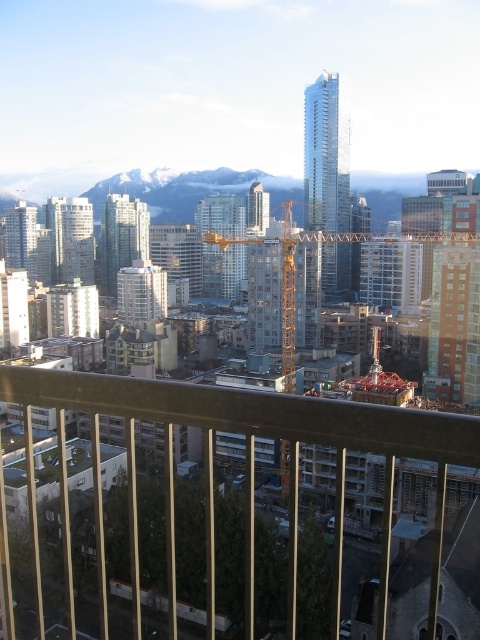
You are standing on a balcony and see a point marked at coordinates (247, 448). Based on the scene, what object is this point likely part of?

The point at (247, 448) is part of the metal construction crane at center, as stated in the objects description.

You are standing on a balcony overlooking the city and see the metal construction crane at center and the yellow metallic crane at center. Which one is positioned more to the left?

The metal construction crane at center is positioned more to the left than the yellow metallic crane at center.

You are a city planner assessing the urban development. You observe the metal construction crane at center and the yellow metallic crane at center from your vantage point. Which crane is farther away from your current position?

The metal construction crane at center is farther away from your current position than the yellow metallic crane at center, as they are 159.53 meters apart.